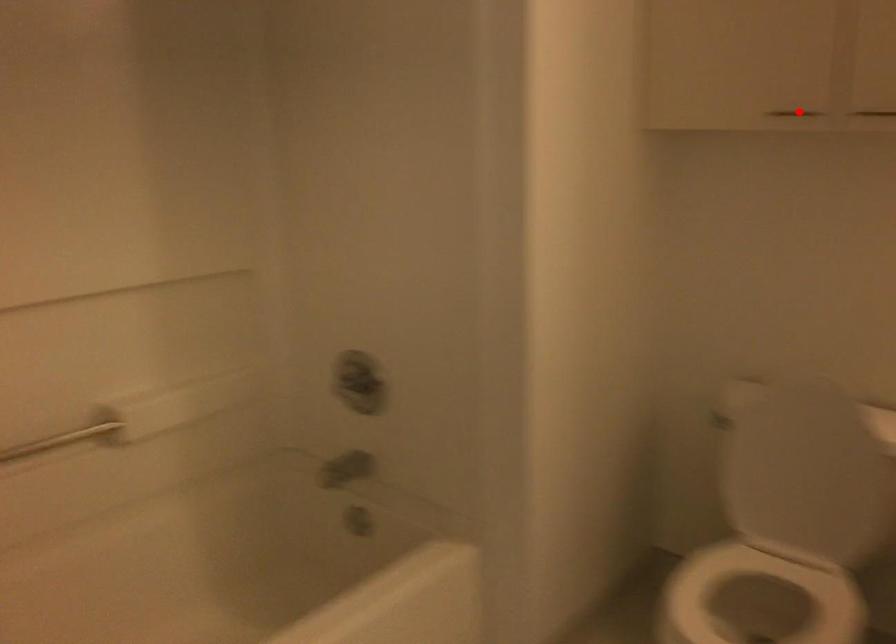
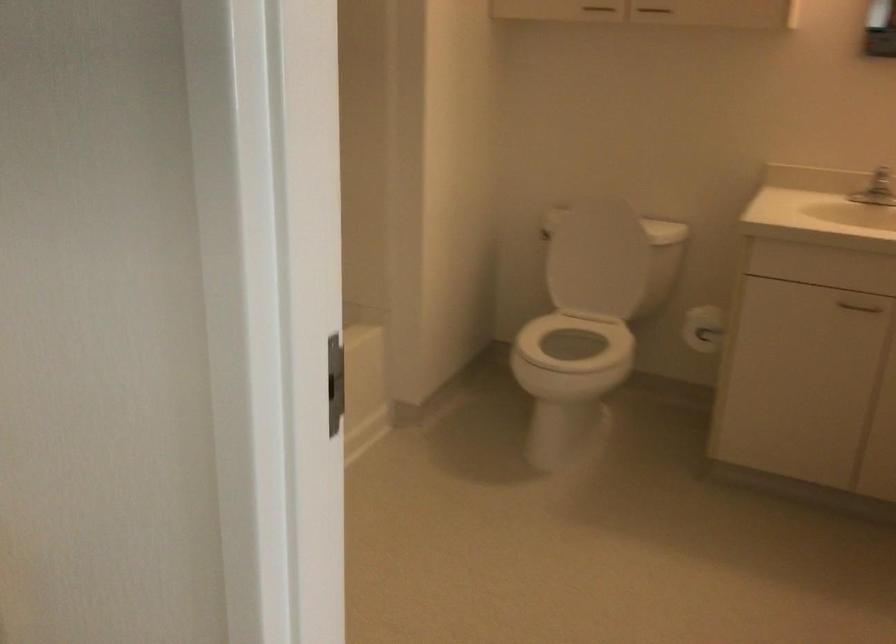
Question: A red point is marked in image1. In image2, is the corresponding 3D point closer to the camera or farther? Reply with the corresponding letter.

Choices:
 (A) The corresponding 3D point is closer.
 (B) The corresponding 3D point is farther.

Answer: (B)